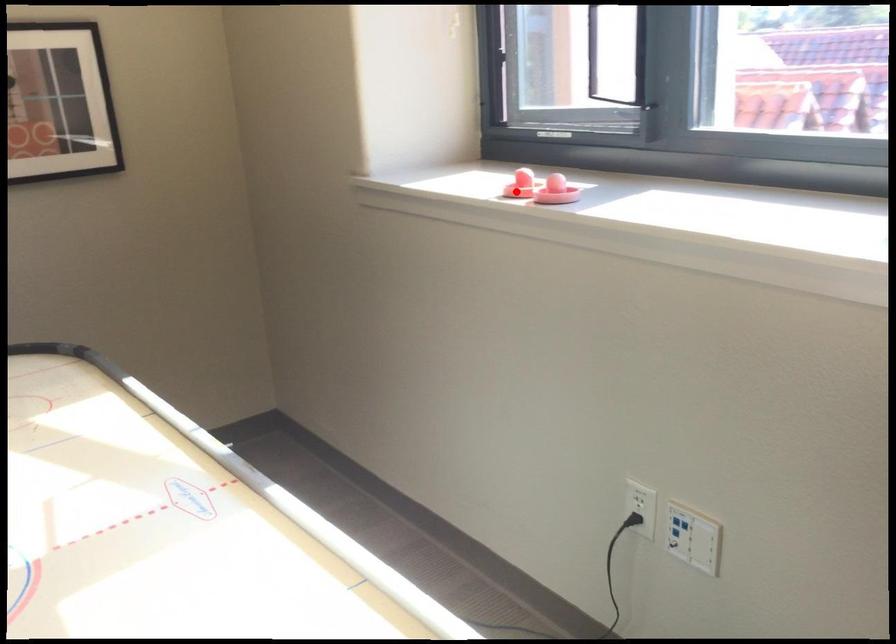
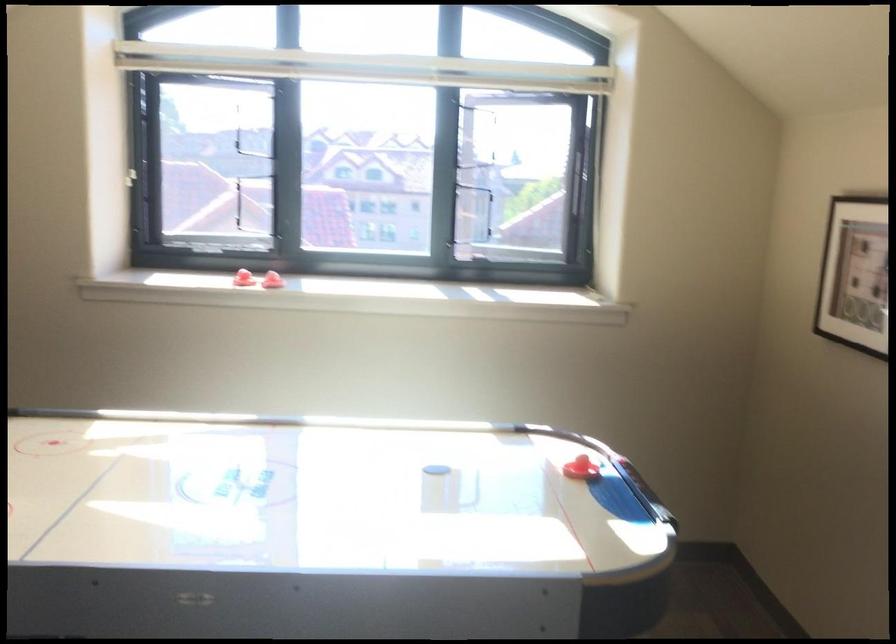
Question: A red point is marked in image1. In image2, is the corresponding 3D point closer to the camera or farther? Reply with the corresponding letter.

Choices:
 (A) The corresponding 3D point is closer.
 (B) The corresponding 3D point is farther.

Answer: (B)